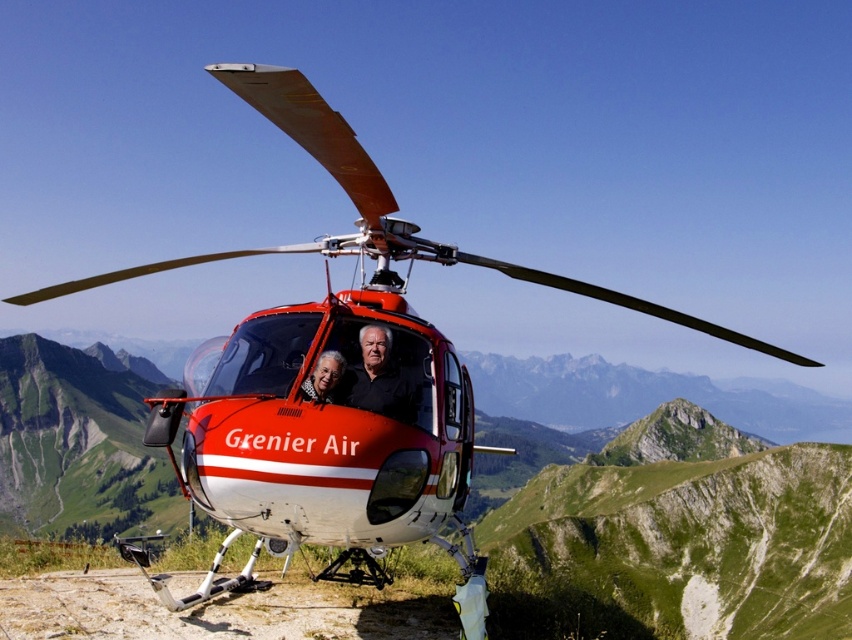
Is black matte shirt at center closer to the viewer compared to smooth black shirt at center?

No.

Does black matte shirt at center lie behind smooth black shirt at center?

Yes, it is behind smooth black shirt at center.

Between point (355, 369) and point (343, 364), which one is positioned in front?

Point (343, 364) is more forward.

This screenshot has width=852, height=640. In order to click on black matte shirt at center in this screenshot , I will do `click(378, 378)`.